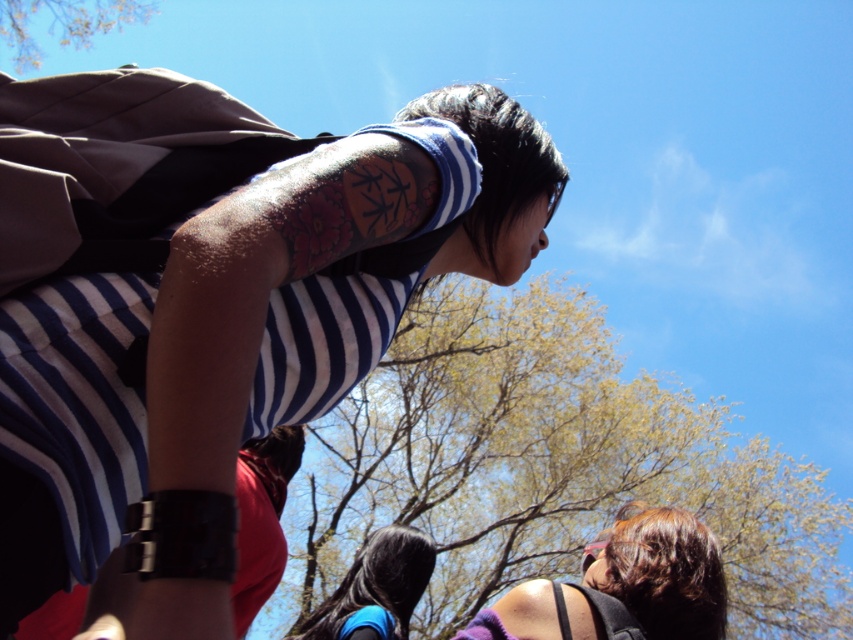
Can you confirm if green leafy tree at upper center is positioned to the left of matte purple tank top at lower right?

Incorrect, green leafy tree at upper center is not on the left side of matte purple tank top at lower right.

Who is more distant from viewer, (393, 490) or (676, 516)?

Positioned behind is point (393, 490).

Which is behind, point (495, 380) or point (604, 634)?

The point (495, 380) is more distant.

The width and height of the screenshot is (853, 640). Identify the location of green leafy tree at upper center. coord(549,467).

This screenshot has width=853, height=640. Describe the element at coordinates (231, 339) in the screenshot. I see `matte striped shirt at center` at that location.

Can you confirm if matte striped shirt at center is thinner than green leafy tree at upper left?

Yes, matte striped shirt at center is thinner than green leafy tree at upper left.

You are a GUI agent. You are given a task and a screenshot of the screen. Output one action in this format:
    pyautogui.click(x=<x>, y=<y>)
    Task: Click on the matte striped shirt at center
    This screenshot has width=853, height=640.
    Given the screenshot: What is the action you would take?
    pyautogui.click(x=231, y=339)

Who is more distant from viewer, (479, 628) or (421, 540)?

The point (421, 540) is behind.

Is the position of matte purple tank top at lower right more distant than that of smooth black hair at center?

No, it is not.

What are the coordinates of `matte purple tank top at lower right` in the screenshot? It's located at (624, 586).